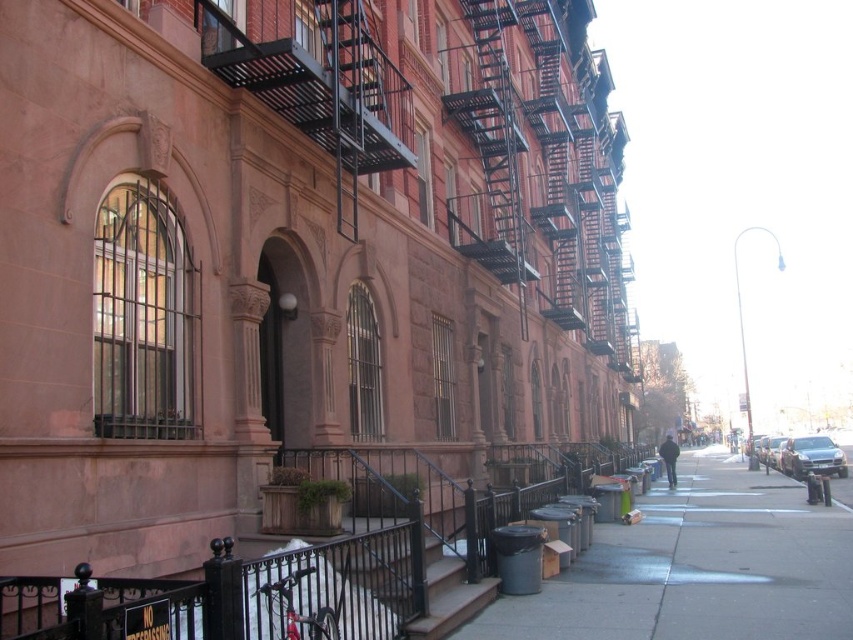
Does brown wood stairs at center have a lesser width compared to shiny silver sedan at center right?

Correct, brown wood stairs at center's width is less than shiny silver sedan at center right's.

Between brown wood stairs at center and shiny silver sedan at center right, which one is positioned higher?

brown wood stairs at center is above.

I want to click on brown wood stairs at center, so click(x=447, y=595).

The height and width of the screenshot is (640, 853). Find the location of `brown wood stairs at center`. brown wood stairs at center is located at coordinates (447, 595).

Does smooth concrete sidewalk at lower center have a greater height compared to brown wood stairs at center?

Indeed, smooth concrete sidewalk at lower center has a greater height compared to brown wood stairs at center.

Is smooth concrete sidewalk at lower center positioned at the back of brown wood stairs at center?

Yes, smooth concrete sidewalk at lower center is behind brown wood stairs at center.

The width and height of the screenshot is (853, 640). Find the location of `smooth concrete sidewalk at lower center`. smooth concrete sidewalk at lower center is located at coordinates (698, 566).

The image size is (853, 640). What are the coordinates of `smooth concrete sidewalk at lower center` in the screenshot? It's located at (698, 566).

Who is shorter, smooth concrete sidewalk at lower center or shiny silver sedan at center right?

Standing shorter between the two is shiny silver sedan at center right.

Does smooth concrete sidewalk at lower center have a greater width compared to shiny silver sedan at center right?

Yes.

Locate an element on the screen. This screenshot has width=853, height=640. smooth concrete sidewalk at lower center is located at coordinates (698, 566).

The image size is (853, 640). I want to click on smooth concrete sidewalk at lower center, so click(x=698, y=566).